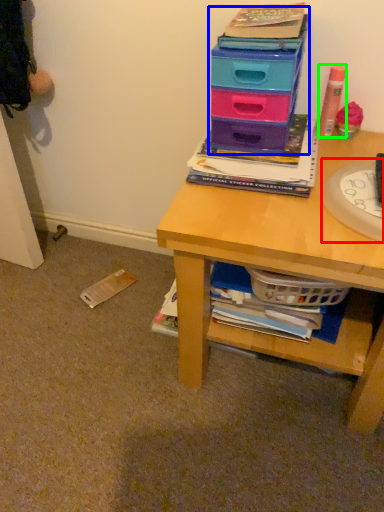
Question: Considering the real-world distances, which object is closest to paper plate (highlighted by a red box)? box (highlighted by a blue box) or stationery (highlighted by a green box).

Choices:
 (A) box
 (B) stationery

Answer: (A)